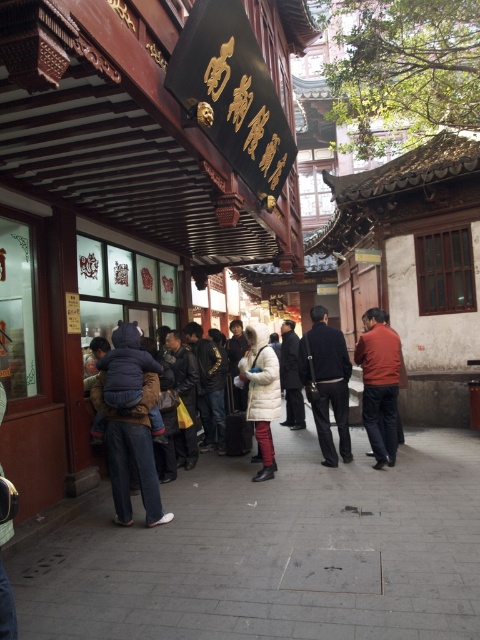
You are a photographer positioned in front of the traditional Chinese building. You notice two coats hanging on a rack near the entrance. Which one is positioned to the left when viewed from your perspective? The coats in question are the dark blue padded jacket at center and the white matte coat at center.

The dark blue padded jacket at center is positioned to the left of the white matte coat at center, so when viewed from your perspective, the dark blue padded jacket at center is on the left side.

You are standing at the entrance of the traditional Chinese building and want to find the dark blue padded jacket at center. According to the coordinates provided, where should you look to find it?

The dark blue padded jacket at center is located at coordinates point (130, 420), so you should look towards the center area slightly to the right and lower portion of the image.

You are a photographer standing near the camera. You want to take a photo of the dark brown leather jacket at center. Is the distance between you and the jacket sufficient to capture a clear, detailed image with your standard camera lens?

The dark brown leather jacket at center and camera are 21.45 feet apart. With a standard camera lens, this distance is sufficient to capture a clear, detailed image as 21.45 feet is within the optimal focusing range for most standard lenses.